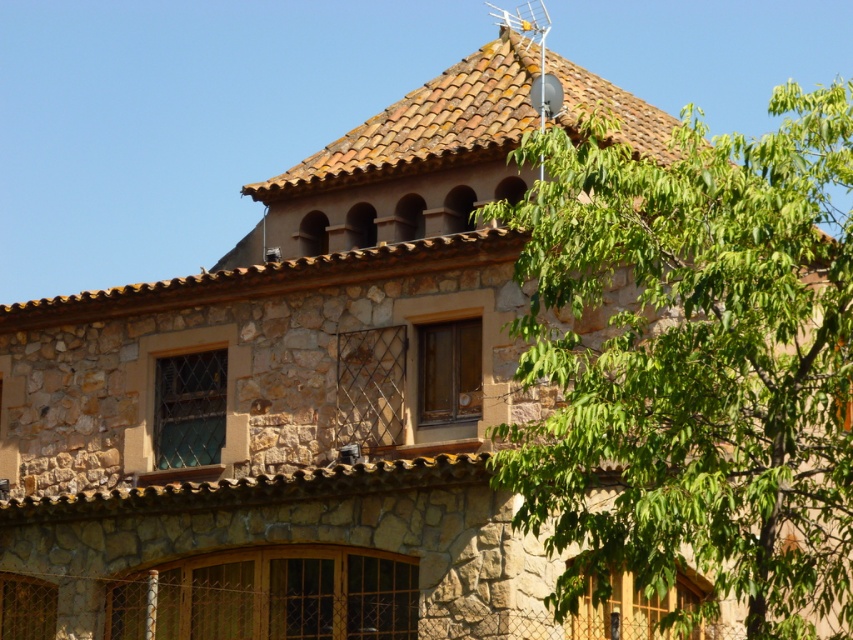
Question: Which object appears farthest from the camera in this image?

Choices:
 (A) green leafy tree at upper right
 (B) brown clay tiles at upper center

Answer: (B)

Question: Is green leafy tree at upper right below brown clay tiles at upper center?

Choices:
 (A) no
 (B) yes

Answer: (B)

Question: Does green leafy tree at upper right lie behind brown clay tiles at upper center?

Choices:
 (A) no
 (B) yes

Answer: (A)

Question: Can you confirm if green leafy tree at upper right is positioned to the left of brown clay tiles at upper center?

Choices:
 (A) yes
 (B) no

Answer: (B)